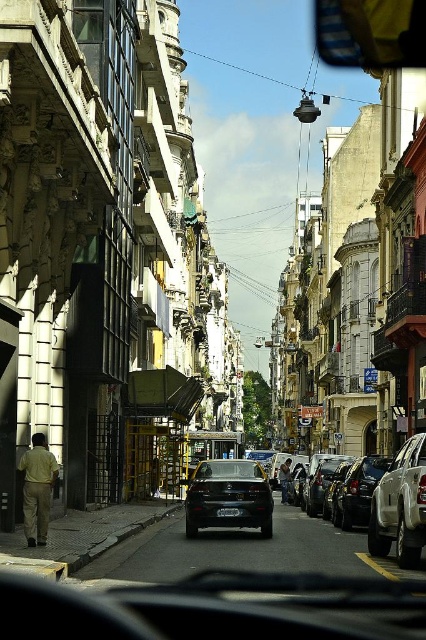
The width and height of the screenshot is (426, 640). What do you see at coordinates (356, 492) in the screenshot? I see `shiny black sedan at right` at bounding box center [356, 492].

Looking at this image, is shiny black sedan at right to the right of light brown leather jacket at center from the viewer's perspective?

Yes, shiny black sedan at right is to the right of light brown leather jacket at center.

The width and height of the screenshot is (426, 640). I want to click on shiny black sedan at right, so click(x=356, y=492).

Measure the distance from white matte car at right to light brown leather jacket at center.

white matte car at right and light brown leather jacket at center are 180.09 feet apart from each other.

Between point (400, 563) and point (281, 493), which one is positioned in front?

Point (400, 563) is in front.

Describe the element at coordinates (400, 506) in the screenshot. I see `white matte car at right` at that location.

I want to click on white matte car at right, so click(400, 506).

Does light brown fabric man at lower left lie behind black plastic license plate at center?

No, it is in front of black plastic license plate at center.

Is light brown fabric man at lower left to the right of black plastic license plate at center from the viewer's perspective?

No, light brown fabric man at lower left is not to the right of black plastic license plate at center.

Who is more distant from viewer, (49, 468) or (221, 508)?

Positioned behind is point (221, 508).

Image resolution: width=426 pixels, height=640 pixels. I want to click on light brown fabric man at lower left, so click(37, 488).